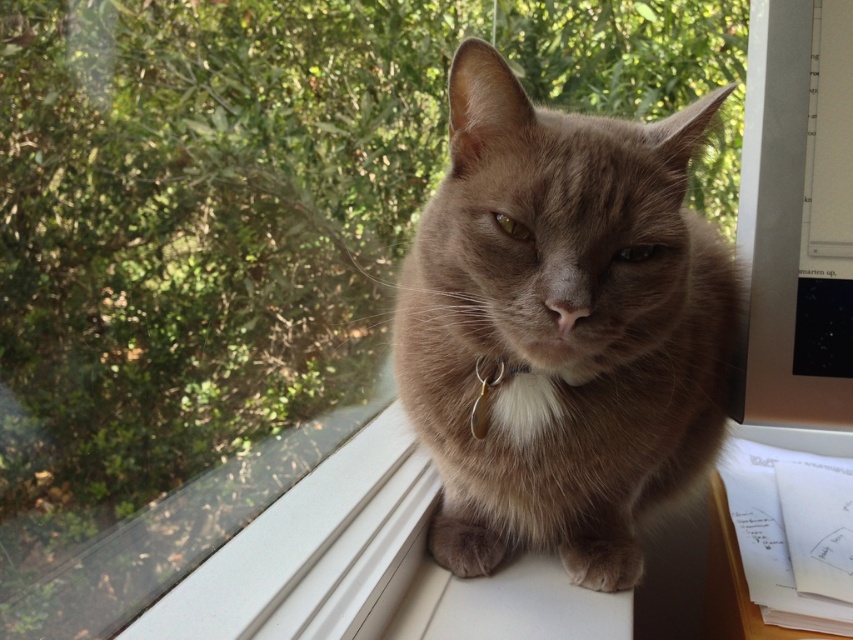
You are a photographer trying to capture a closeup of the fuzzy brown cat at center and the silver metallic collar at center. The camera you are using has a minimum focusing distance of 15 centimeters. Can you take a clear photo of both objects without moving the camera closer?

The fuzzy brown cat at center and silver metallic collar at center are 17.24 centimeters apart. Since the minimum focusing distance is 15 centimeters, the camera can focus on both objects as they are within the required distance.

Looking at this image, you are an animal photographer who wants to capture the cat in the center. The camera has a focus point at coordinate point (x=561, y=326). Is this focus point correctly positioned to capture the cat?

The point (x=561, y=326) corresponds to fuzzy brown cat at center, so yes, the focus point is correctly positioned to capture the cat.

Based on the scene description, if you were to draw a straight vertical line from the top of the fuzzy brown cat at center to the bottom, would this line pass through the silver metallic collar at center?

Yes, because the fuzzy brown cat at center is above the silver metallic collar at center, so a vertical line drawn from the cat would pass through the collar.